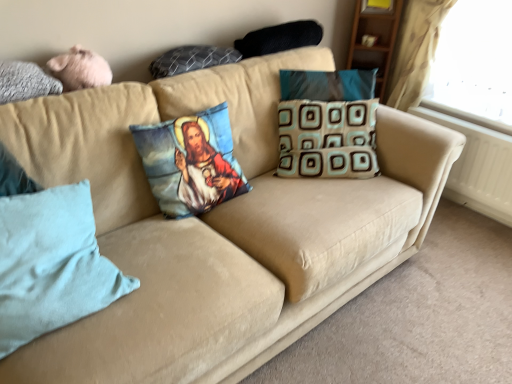
I want to click on gray textured pillow at upper left, which is the 3th pillow from top to bottom, so click(x=25, y=82).

This screenshot has height=384, width=512. Describe the element at coordinates (25, 82) in the screenshot. I see `gray textured pillow at upper left, which is the 3th pillow from top to bottom` at that location.

What are the coordinates of `white plastic radiator at lower right` in the screenshot? It's located at (478, 167).

This screenshot has width=512, height=384. What do you see at coordinates (478, 167) in the screenshot?
I see `white plastic radiator at lower right` at bounding box center [478, 167].

Measure the distance between textured gray pillow at upper center, which appears as the 5th pillow when ordered from the bottom, and camera.

textured gray pillow at upper center, which appears as the 5th pillow when ordered from the bottom, is 1.70 meters away from camera.

In order to click on teal and brown patterned pillow at center, marked as the third pillow in a bottom-to-top arrangement in this screenshot , I will do `click(327, 139)`.

This screenshot has height=384, width=512. Describe the element at coordinates (51, 264) in the screenshot. I see `light blue fabric pillow at lower left, which is the 1th pillow in bottom-to-top order` at that location.

Measure the distance between textured fabric pillow at center, which is counted as the fifth pillow, starting from the top, and camera.

textured fabric pillow at center, which is counted as the fifth pillow, starting from the top, and camera are 1.55 meters apart.

Describe the element at coordinates (279, 38) in the screenshot. I see `black textured pillow at upper center, positioned as the first pillow in top-to-bottom order` at that location.

Where is `gray textured pillow at upper left, which is the 4th pillow from bottom to top`? The image size is (512, 384). gray textured pillow at upper left, which is the 4th pillow from bottom to top is located at coordinates (25, 82).

The height and width of the screenshot is (384, 512). What are the coordinates of `the 3rd pillow below the textured gray pillow at upper center, which is the second pillow in top-to-bottom order (from the image's perspective)` in the screenshot? It's located at (191, 162).

Is textured gray pillow at upper center, which appears as the 5th pillow when ordered from the bottom, located outside textured fabric pillow at center, which is the second pillow in bottom-to-top order?

Indeed, textured gray pillow at upper center, which appears as the 5th pillow when ordered from the bottom, is completely outside textured fabric pillow at center, which is the second pillow in bottom-to-top order.

From their relative heights in the image, would you say textured gray pillow at upper center, which appears as the 5th pillow when ordered from the bottom, is taller or shorter than textured fabric pillow at center, which is the second pillow in bottom-to-top order?

Considering their sizes, textured gray pillow at upper center, which appears as the 5th pillow when ordered from the bottom, has less height than textured fabric pillow at center, which is the second pillow in bottom-to-top order.

Is translucent fabric at upper right not near textured fabric pillow at center, which is counted as the fifth pillow, starting from the top?

translucent fabric at upper right is far away from textured fabric pillow at center, which is counted as the fifth pillow, starting from the top.

Considering the sizes of objects translucent fabric at upper right and textured fabric pillow at center, which is counted as the fifth pillow, starting from the top, in the image provided, who is shorter, translucent fabric at upper right or textured fabric pillow at center, which is counted as the fifth pillow, starting from the top,?

With less height is textured fabric pillow at center, which is counted as the fifth pillow, starting from the top.

In the scene shown: Considering the sizes of objects translucent fabric at upper right and textured fabric pillow at center, which is the second pillow in bottom-to-top order, in the image provided, who is bigger, translucent fabric at upper right or textured fabric pillow at center, which is the second pillow in bottom-to-top order,?

translucent fabric at upper right.

Which is more to the right, light blue fabric pillow at lower left, the 6th pillow viewed from the top, or gray textured pillow at upper left, which is the 4th pillow from bottom to top?

From the viewer's perspective, light blue fabric pillow at lower left, the 6th pillow viewed from the top, appears more on the right side.

Is light blue fabric pillow at lower left, the 6th pillow viewed from the top, next to gray textured pillow at upper left, which is the 4th pillow from bottom to top, and touching it?

There is a gap between light blue fabric pillow at lower left, the 6th pillow viewed from the top, and gray textured pillow at upper left, which is the 4th pillow from bottom to top.

Is point (106, 266) closer or farther from the camera than point (10, 63)?

Clearly, point (106, 266) is closer to the camera than point (10, 63).

Is textured gray pillow at upper center, which is the second pillow in top-to-bottom order, outside of gray textured pillow at upper left, which is the 4th pillow from bottom to top?

Yes, textured gray pillow at upper center, which is the second pillow in top-to-bottom order, is located beyond the bounds of gray textured pillow at upper left, which is the 4th pillow from bottom to top.

Does textured gray pillow at upper center, which is the second pillow in top-to-bottom order, have a larger size compared to gray textured pillow at upper left, which is the 4th pillow from bottom to top?

Actually, textured gray pillow at upper center, which is the second pillow in top-to-bottom order, might be smaller than gray textured pillow at upper left, which is the 4th pillow from bottom to top.

Could you tell me if textured gray pillow at upper center, which is the second pillow in top-to-bottom order, is facing gray textured pillow at upper left, which is the 3th pillow from top to bottom?

No.

Can you confirm if black textured pillow at upper center, the sixth pillow positioned from the bottom, is bigger than textured gray pillow at upper center, which is the second pillow in top-to-bottom order?

Yes, black textured pillow at upper center, the sixth pillow positioned from the bottom, is bigger than textured gray pillow at upper center, which is the second pillow in top-to-bottom order.

Considering the sizes of objects black textured pillow at upper center, positioned as the first pillow in top-to-bottom order, and textured gray pillow at upper center, which appears as the 5th pillow when ordered from the bottom, in the image provided, who is wider, black textured pillow at upper center, positioned as the first pillow in top-to-bottom order, or textured gray pillow at upper center, which appears as the 5th pillow when ordered from the bottom,?

Wider between the two is black textured pillow at upper center, positioned as the first pillow in top-to-bottom order.

What are the coordinates of `pillow that is the 2nd one when counting leftward from the black textured pillow at upper center, the sixth pillow positioned from the bottom` in the screenshot? It's located at (191, 59).

In the scene shown: Which object is wider, black textured pillow at upper center, positioned as the first pillow in top-to-bottom order, or gray textured pillow at upper left, which is the 3th pillow from top to bottom?

Wider between the two is black textured pillow at upper center, positioned as the first pillow in top-to-bottom order.

Does black textured pillow at upper center, positioned as the first pillow in top-to-bottom order, have a smaller size compared to gray textured pillow at upper left, which is the 3th pillow from top to bottom?

Incorrect, black textured pillow at upper center, positioned as the first pillow in top-to-bottom order, is not smaller in size than gray textured pillow at upper left, which is the 3th pillow from top to bottom.

Which point is more forward, (312, 22) or (0, 95)?

The point (0, 95) is closer to the camera.

Is black textured pillow at upper center, the sixth pillow positioned from the bottom, to the right of gray textured pillow at upper left, which is the 3th pillow from top to bottom, from the viewer's perspective?

Yes, black textured pillow at upper center, the sixth pillow positioned from the bottom, is to the right of gray textured pillow at upper left, which is the 3th pillow from top to bottom.

From a real-world perspective, relative to textured fabric pillow at center, which is the second pillow in bottom-to-top order, is light blue fabric pillow at lower left, which is the 1th pillow in bottom-to-top order, vertically above or below?

In terms of real-world spatial position, light blue fabric pillow at lower left, which is the 1th pillow in bottom-to-top order, is below textured fabric pillow at center, which is the second pillow in bottom-to-top order.

Identify the location of pillow that is the 2nd one below the textured fabric pillow at center, which is the second pillow in bottom-to-top order (from a real-world perspective). (51, 264).

Is textured fabric pillow at center, which is counted as the fifth pillow, starting from the top, completely or partially inside light blue fabric pillow at lower left, which is the 1th pillow in bottom-to-top order?

No, textured fabric pillow at center, which is counted as the fifth pillow, starting from the top, is not surrounded by light blue fabric pillow at lower left, which is the 1th pillow in bottom-to-top order.

Considering the sizes of objects light blue fabric pillow at lower left, the 6th pillow viewed from the top, and textured fabric pillow at center, which is counted as the fifth pillow, starting from the top, in the image provided, who is shorter, light blue fabric pillow at lower left, the 6th pillow viewed from the top, or textured fabric pillow at center, which is counted as the fifth pillow, starting from the top,?

With less height is light blue fabric pillow at lower left, the 6th pillow viewed from the top.

Find the location of a particular element. The width and height of the screenshot is (512, 384). pillow that is the 1st one when counting backward from the textured fabric pillow at center, which is counted as the fifth pillow, starting from the top is located at coordinates (191, 59).

Where is `the 3rd pillow counting from the left side of the translucent fabric at upper right`? the 3rd pillow counting from the left side of the translucent fabric at upper right is located at coordinates (191, 162).

Estimate the real-world distances between objects in this image. Which object is closer to black textured pillow at upper center, the sixth pillow positioned from the bottom, light blue fabric pillow at lower left, the 6th pillow viewed from the top, or textured gray pillow at upper center, which appears as the 5th pillow when ordered from the bottom?

The object closer to black textured pillow at upper center, the sixth pillow positioned from the bottom, is textured gray pillow at upper center, which appears as the 5th pillow when ordered from the bottom.

Looking at the image, which one is located closer to white plastic radiator at lower right, translucent fabric at upper right or gray textured pillow at upper left, which is the 4th pillow from bottom to top?

Based on the image, translucent fabric at upper right appears to be nearer to white plastic radiator at lower right.

From the image, which object appears to be nearer to light blue fabric pillow at lower left, which is the 1th pillow in bottom-to-top order, translucent fabric at upper right or gray textured pillow at upper left, which is the 4th pillow from bottom to top?

Based on the image, gray textured pillow at upper left, which is the 4th pillow from bottom to top, appears to be nearer to light blue fabric pillow at lower left, which is the 1th pillow in bottom-to-top order.

From the image, which object appears to be nearer to light blue fabric pillow at lower left, the 6th pillow viewed from the top, white plastic radiator at lower right or gray textured pillow at upper left, which is the 3th pillow from top to bottom?

gray textured pillow at upper left, which is the 3th pillow from top to bottom, is closer to light blue fabric pillow at lower left, the 6th pillow viewed from the top.

In the scene shown: From the image, which object appears to be nearer to light blue fabric pillow at lower left, which is the 1th pillow in bottom-to-top order, gray textured pillow at upper left, which is the 4th pillow from bottom to top, or translucent fabric at upper right?

Based on the image, gray textured pillow at upper left, which is the 4th pillow from bottom to top, appears to be nearer to light blue fabric pillow at lower left, which is the 1th pillow in bottom-to-top order.

Estimate the real-world distances between objects in this image. Which object is closer to textured fabric pillow at center, which is counted as the fifth pillow, starting from the top, black textured pillow at upper center, positioned as the first pillow in top-to-bottom order, or gray textured pillow at upper left, which is the 4th pillow from bottom to top?

Among the two, gray textured pillow at upper left, which is the 4th pillow from bottom to top, is located nearer to textured fabric pillow at center, which is counted as the fifth pillow, starting from the top.

Based on the photo, when comparing their distances from translucent fabric at upper right, does textured fabric pillow at center, which is counted as the fifth pillow, starting from the top, or gray textured pillow at upper left, which is the 3th pillow from top to bottom, seem closer?

Based on the image, textured fabric pillow at center, which is counted as the fifth pillow, starting from the top, appears to be nearer to translucent fabric at upper right.

Looking at the image, which one is located further to translucent fabric at upper right, white plastic radiator at lower right or black textured pillow at upper center, positioned as the first pillow in top-to-bottom order?

black textured pillow at upper center, positioned as the first pillow in top-to-bottom order.

Locate an element on the screen. This screenshot has height=384, width=512. window screen situated between textured gray pillow at upper center, which is the second pillow in top-to-bottom order, and white plastic radiator at lower right from left to right is located at coordinates (474, 64).

Find the location of `window screen between gray textured pillow at upper left, which is the 4th pillow from bottom to top, and white plastic radiator at lower right`. window screen between gray textured pillow at upper left, which is the 4th pillow from bottom to top, and white plastic radiator at lower right is located at coordinates (x=474, y=64).

You are a GUI agent. You are given a task and a screenshot of the screen. Output one action in this format:
    pyautogui.click(x=<x>, y=<y>)
    Task: Click on the pillow between black textured pillow at upper center, positioned as the first pillow in top-to-bottom order, and white plastic radiator at lower right from left to right
    
    Given the screenshot: What is the action you would take?
    pyautogui.click(x=327, y=139)

This screenshot has width=512, height=384. I want to click on pillow located between black textured pillow at upper center, the sixth pillow positioned from the bottom, and translucent fabric at upper right in the left-right direction, so click(327, 139).